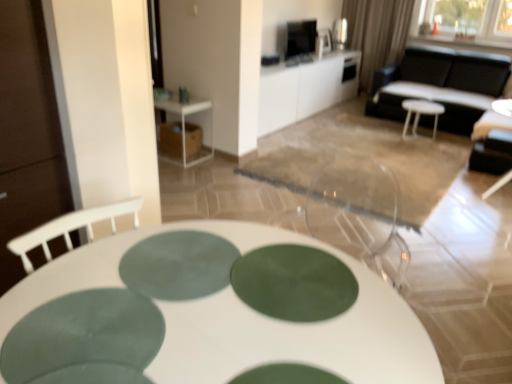
This screenshot has width=512, height=384. I want to click on vacant space situated on the left part of green matte placemat at center, so click(75, 279).